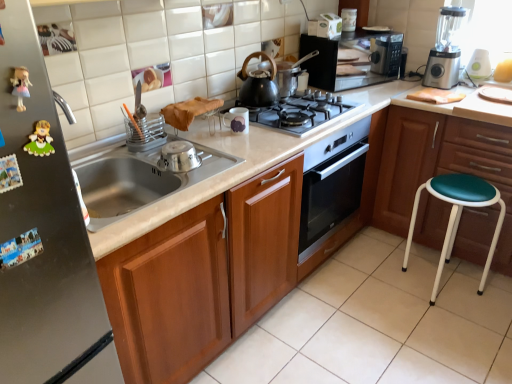
Locate an element on the screen. The image size is (512, 384). vacant area that is in front of satin silver blender at upper right is located at coordinates (457, 92).